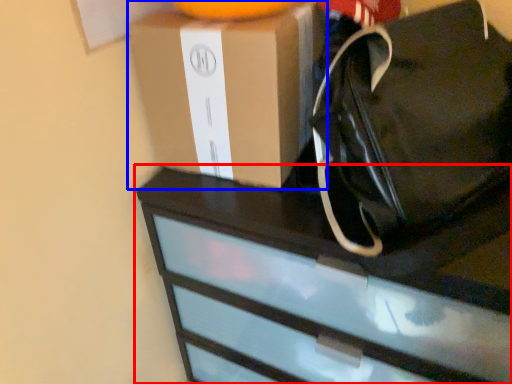
Question: Which point is closer to the camera, chest of drawers (highlighted by a red box) or box (highlighted by a blue box)?

Choices:
 (A) chest of drawers
 (B) box

Answer: (A)